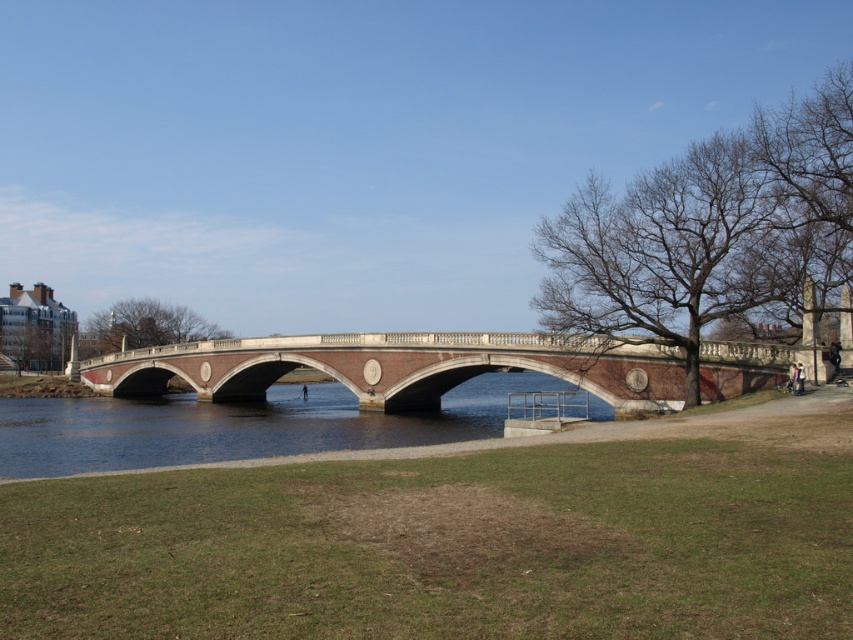
How far apart are brick stone bridge at center and black matte person at center?

A distance of 20.26 meters exists between brick stone bridge at center and black matte person at center.

Is point (637, 384) more distant than point (305, 396)?

That is False.

The width and height of the screenshot is (853, 640). Describe the element at coordinates (439, 368) in the screenshot. I see `brick stone bridge at center` at that location.

At what (x,y) coordinates should I click in order to perform the action: click on brick stone bridge at center. Please return your answer as a coordinate pair (x, y). Looking at the image, I should click on (439, 368).

Which is more to the left, blue stone water at center or black matte person at center?

Positioned to the left is blue stone water at center.

Is blue stone water at center bigger than black matte person at center?

Yes.

The image size is (853, 640). I want to click on blue stone water at center, so click(236, 426).

What do you see at coordinates (236, 426) in the screenshot?
I see `blue stone water at center` at bounding box center [236, 426].

In the scene shown: Who is more forward, (x=236, y=436) or (x=801, y=385)?

Point (x=801, y=385)

Does point (212, 454) lie in front of point (796, 387)?

No, (212, 454) is behind (796, 387).

At what (x,y) coordinates should I click in order to perform the action: click on blue stone water at center. Please return your answer as a coordinate pair (x, y). Looking at the image, I should click on (236, 426).